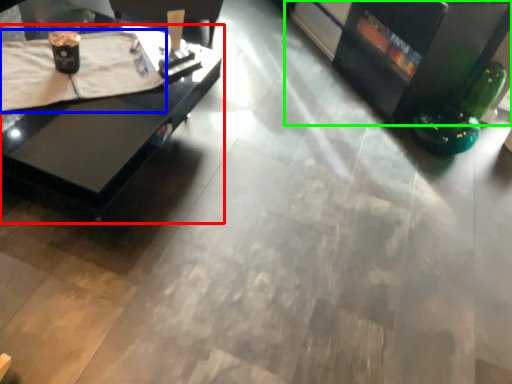
Question: Which is farther away from table (highlighted by a red box)? blanket (highlighted by a blue box) or entertainment center (highlighted by a green box)?

Choices:
 (A) blanket
 (B) entertainment center

Answer: (B)